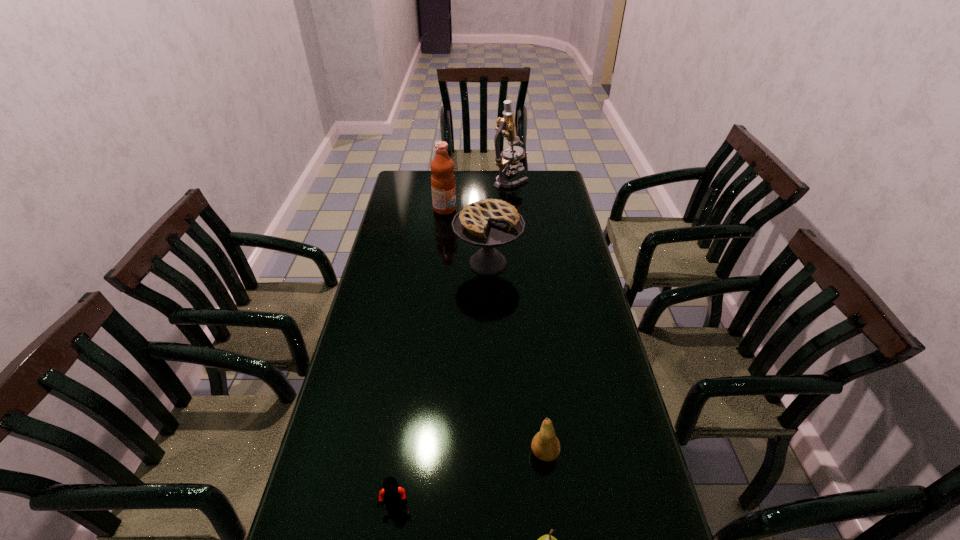
You are a GUI agent. You are given a task and a screenshot of the screen. Output one action in this format:
    pyautogui.click(x=<x>, y=<y>)
    Task: Click on the microscope
    This screenshot has width=960, height=540.
    Given the screenshot: What is the action you would take?
    pyautogui.click(x=504, y=159)

Locate an element on the screen. This screenshot has height=540, width=960. the tallest object is located at coordinates (504, 159).

Locate an element on the screen. Image resolution: width=960 pixels, height=540 pixels. the fifth shortest object is located at coordinates (443, 187).

You are a GUI agent. You are given a task and a screenshot of the screen. Output one action in this format:
    pyautogui.click(x=<x>, y=<y>)
    Task: Click on the second farthest object
    
    Given the screenshot: What is the action you would take?
    pyautogui.click(x=443, y=187)

Where is `the third tallest object`? the third tallest object is located at coordinates (488, 223).

You are a GUI agent. You are given a task and a screenshot of the screen. Output one action in this format:
    pyautogui.click(x=<x>, y=<y>)
    Task: Click on the pie
    The image size is (960, 540).
    Given the screenshot: What is the action you would take?
    pyautogui.click(x=488, y=223)

You are a GUI agent. You are given a task and a screenshot of the screen. Output one action in this format:
    pyautogui.click(x=<x>, y=<y>)
    Task: Click on the taller pear
    The image size is (960, 540).
    Given the screenshot: What is the action you would take?
    pyautogui.click(x=545, y=445)

Locate an element on the screen. This screenshot has height=540, width=960. the fourth farthest object is located at coordinates (545, 445).

The width and height of the screenshot is (960, 540). Find the location of `the second nearest object`. the second nearest object is located at coordinates (392, 494).

Locate an element on the screen. vacant space located 0.260m on the left of the microscope is located at coordinates 438,181.